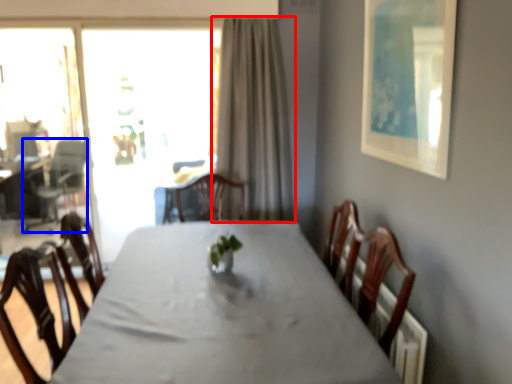
Question: Which point is further to the camera, curtain (highlighted by a red box) or armchair (highlighted by a blue box)?

Choices:
 (A) curtain
 (B) armchair

Answer: (B)